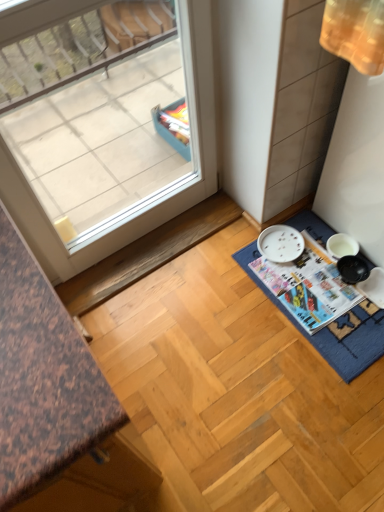
Question: Considering the positions of white glossy magazine at lower right and blue fabric bath mat at lower right in the image, is white glossy magazine at lower right taller or shorter than blue fabric bath mat at lower right?

Choices:
 (A) short
 (B) tall

Answer: (B)

Question: In terms of width, does white glossy magazine at lower right look wider or thinner when compared to blue fabric bath mat at lower right?

Choices:
 (A) thin
 (B) wide

Answer: (A)

Question: Considering the real-world distances, which object is farthest from the white glossy magazine at lower right?

Choices:
 (A) transparent glass window at upper left
 (B) blue fabric bath mat at lower right

Answer: (A)

Question: Estimate the real-world distances between objects in this image. Which object is farther from the white glossy magazine at lower right?

Choices:
 (A) blue fabric bath mat at lower right
 (B) transparent glass window at upper left

Answer: (B)